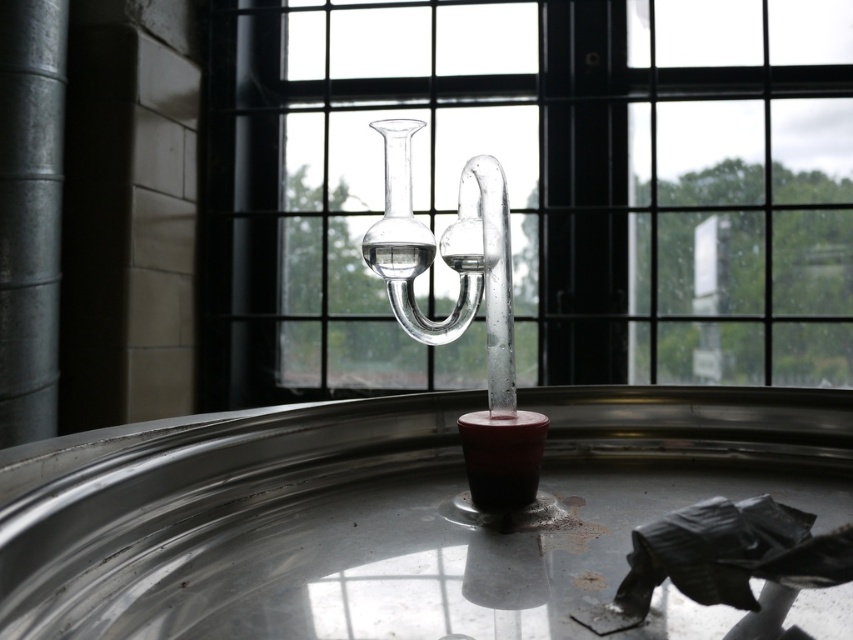
Question: Which of the following is the closest to the observer?

Choices:
 (A) (355, 90)
 (B) (3, 92)
 (C) (386, 248)
 (D) (523, 468)

Answer: (C)

Question: Can you confirm if smooth metallic pillar at left is wider than matte black candle holder at center?

Choices:
 (A) no
 (B) yes

Answer: (A)

Question: Estimate the real-world distances between objects in this image. Which object is closer to the smooth metallic pillar at left?

Choices:
 (A) matte black candle holder at center
 (B) transparent glass window at center
 (C) transparent glass vase at center

Answer: (B)

Question: Observing the image, what is the correct spatial positioning of transparent glass window at center in reference to matte black candle holder at center?

Choices:
 (A) right
 (B) left

Answer: (A)

Question: Considering the relative positions of transparent glass window at center and smooth metallic pillar at left in the image provided, where is transparent glass window at center located with respect to smooth metallic pillar at left?

Choices:
 (A) left
 (B) right

Answer: (B)

Question: Which point is farther to the camera?

Choices:
 (A) transparent glass vase at center
 (B) smooth metallic pillar at left
 (C) transparent glass window at center
 (D) matte black candle holder at center

Answer: (B)